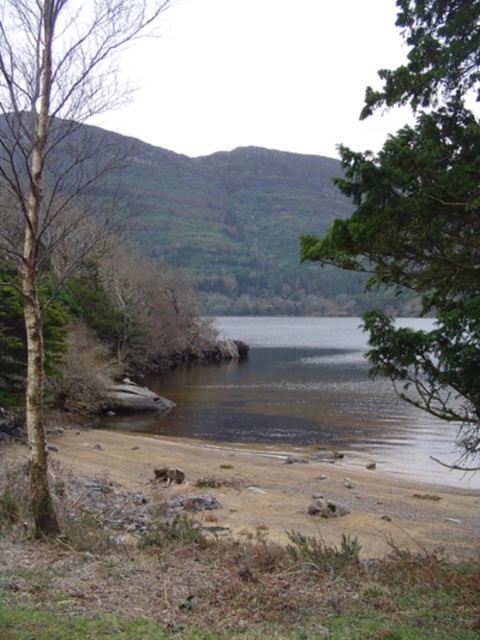
Does point (416, 353) lie in front of point (14, 172)?

No, it is not.

Does green leafy tree at upper right appear over bare bark tree at left?

No.

Between point (367, 92) and point (22, 168), which one is positioned in front?

Positioned in front is point (367, 92).

The width and height of the screenshot is (480, 640). I want to click on green leafy tree at upper right, so click(421, 218).

Which is above, green leafy tree at upper right or brown sand at lower left?

Positioned higher is green leafy tree at upper right.

Who is more forward, [420,108] or [252,490]?

Point [420,108] is more forward.

Does point (414, 337) come in front of point (240, 509)?

Yes, point (414, 337) is closer to viewer.

The image size is (480, 640). I want to click on green leafy tree at upper right, so click(x=421, y=218).

Is bare bark tree at left closer to the viewer compared to brown smooth water at lower center?

Yes, bare bark tree at left is in front of brown smooth water at lower center.

Does point (36, 0) come farther from viewer compared to point (437, 468)?

No, (36, 0) is closer to viewer.

Identify the location of bare bark tree at left. (58, 164).